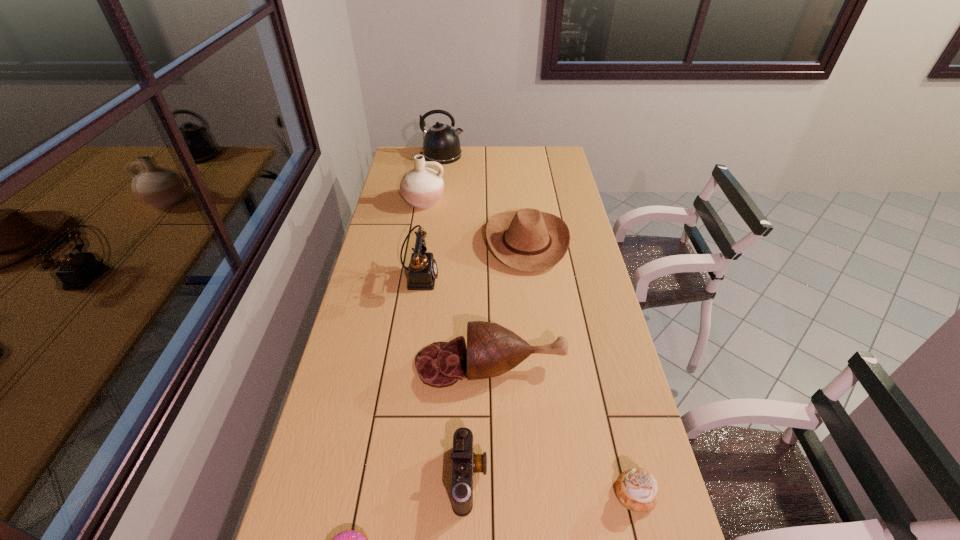
The image size is (960, 540). I want to click on kettle, so click(x=441, y=143).

Find the location of `the second farthest object`. the second farthest object is located at coordinates (422, 187).

Find the location of a particular element. telephone is located at coordinates (422, 272).

You are a GUI agent. You are given a task and a screenshot of the screen. Output one action in this format:
    pyautogui.click(x=<x>, y=<y>)
    Task: Click on the ham
    The width and height of the screenshot is (960, 540).
    Given the screenshot: What is the action you would take?
    pyautogui.click(x=492, y=350)

This screenshot has width=960, height=540. Find the location of `cowboy hat`. cowboy hat is located at coordinates coord(528,240).

At what (x,y) coordinates should I click in order to perform the action: click on camera. Please return your answer as a coordinate pair (x, y). Looking at the image, I should click on (465, 463).

Find the location of a particular element. This screenshot has width=960, height=540. pastry is located at coordinates (636, 489).

Identify the location of free space located 0.100m on the spout of the farthest object. The image size is (960, 540). (483, 156).

The height and width of the screenshot is (540, 960). What are the coordinates of `blank area located 0.400m to pour from the handle of the pottery` in the screenshot? It's located at (411, 275).

The width and height of the screenshot is (960, 540). What are the coordinates of `free space located on the front of the telephone at the rotary dial` in the screenshot? It's located at (495, 276).